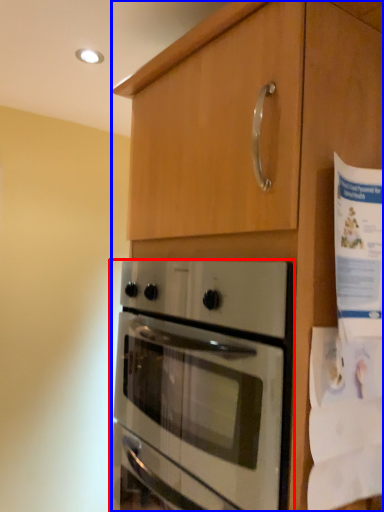
Question: Which of the following is the closest to the observer, oven (highlighted by a red box) or cabinetry (highlighted by a blue box)?

Choices:
 (A) oven
 (B) cabinetry

Answer: (B)